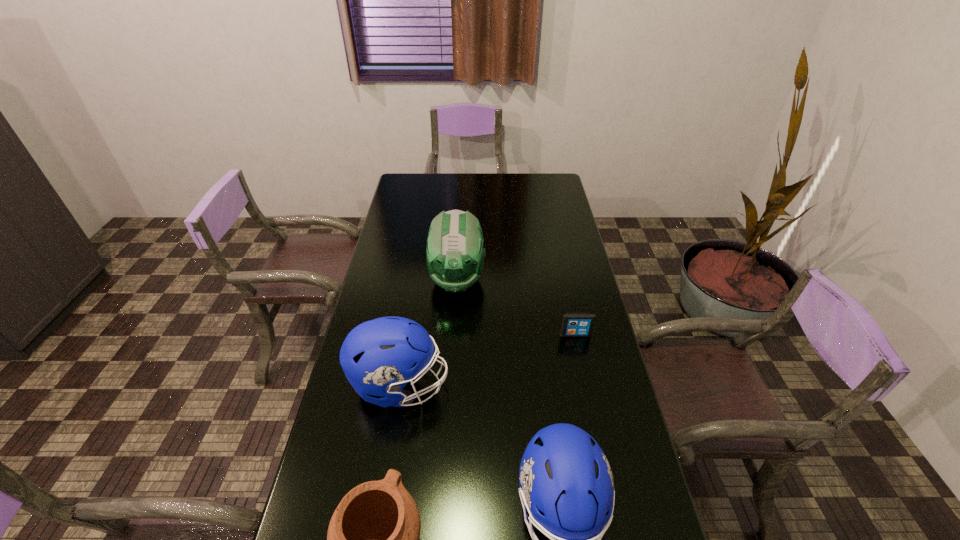
The width and height of the screenshot is (960, 540). Identify the location of free space that satisfies the following two spatial constraints: 1. on the front screen of the fourth nearest object; 2. on the front-facing side of the third nearest object. (587, 385).

Where is `free space that satisfies the following two spatial constraints: 1. on the visor of the farthest object; 2. on the front-facing side of the second nearest football helmet`? This screenshot has height=540, width=960. free space that satisfies the following two spatial constraints: 1. on the visor of the farthest object; 2. on the front-facing side of the second nearest football helmet is located at coordinates (450, 385).

At what (x,y) coordinates should I click in order to perform the action: click on free space that satisfies the following two spatial constraints: 1. on the visor of the farthest object; 2. on the front-facing side of the second nearest football helmet. Please return your answer as a coordinate pair (x, y). Looking at the image, I should click on (450, 385).